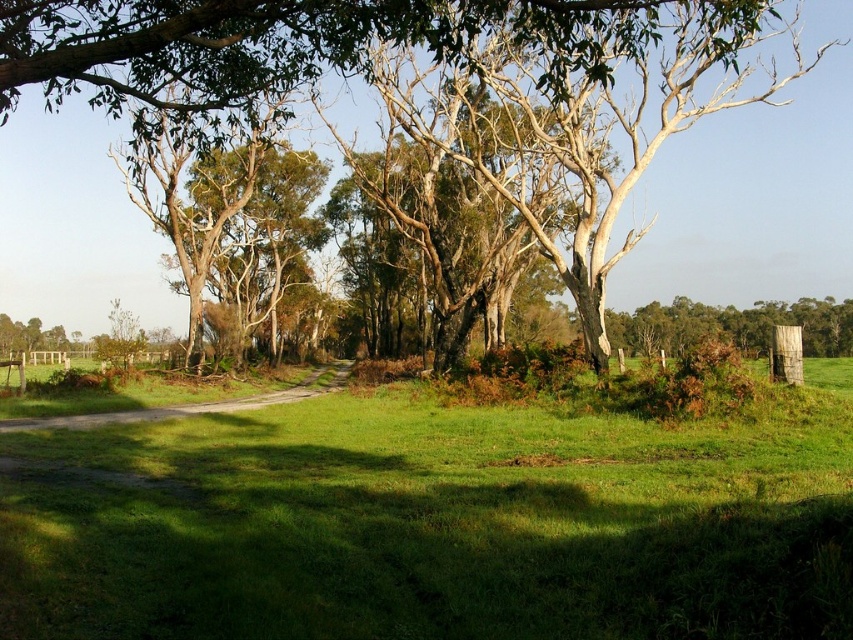
Is the position of green grass at center more distant than that of green leafy tree at center?

That is False.

Looking at this image, who is more forward, (129, 456) or (640, 273)?

Point (129, 456) is in front.

Does point (239, 426) come farther from viewer compared to point (76, 323)?

That is False.

Identify the location of green grass at center. The height and width of the screenshot is (640, 853). pyautogui.click(x=439, y=524).

Which is more to the right, green grass at center or dirt road at center?

From the viewer's perspective, green grass at center appears more on the right side.

Between green grass at center and dirt road at center, which one appears on the left side from the viewer's perspective?

Positioned to the left is dirt road at center.

This screenshot has height=640, width=853. In order to click on green grass at center in this screenshot , I will do `click(439, 524)`.

The image size is (853, 640). I want to click on green grass at center, so pos(439,524).

Does green leafy tree at center have a larger size compared to dirt road at center?

Yes.

Is point (833, 253) less distant than point (312, 381)?

No.

What do you see at coordinates (752, 193) in the screenshot? The image size is (853, 640). I see `green leafy tree at center` at bounding box center [752, 193].

Locate an element on the screen. green leafy tree at center is located at coordinates [752, 193].